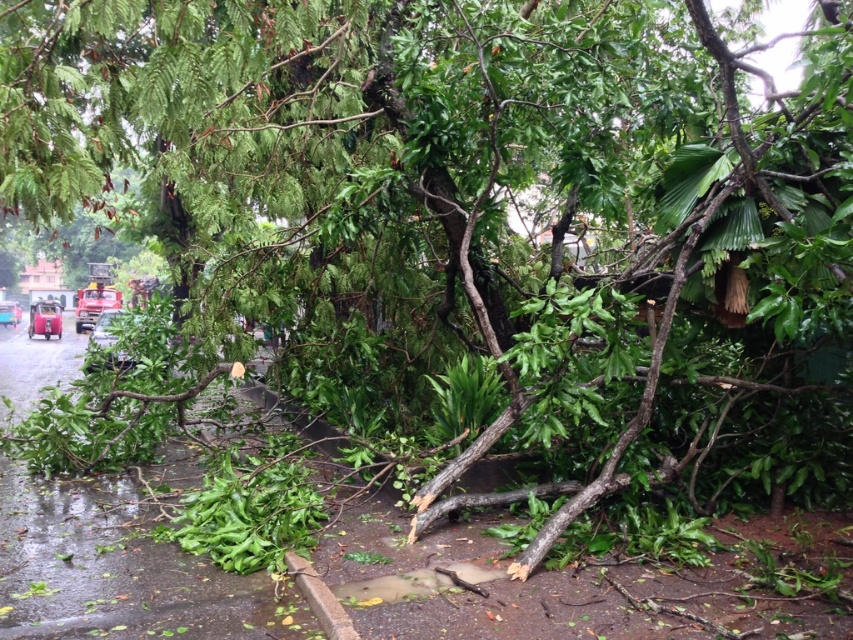
Can you confirm if metallic red car at left is thinner than metallic blue car at lower left?

Incorrect, metallic red car at left's width is not less than metallic blue car at lower left's.

Can you confirm if metallic red car at left is positioned below metallic blue car at lower left?

Yes, metallic red car at left is below metallic blue car at lower left.

This screenshot has height=640, width=853. I want to click on metallic red car at left, so click(44, 317).

I want to click on metallic red car at left, so click(44, 317).